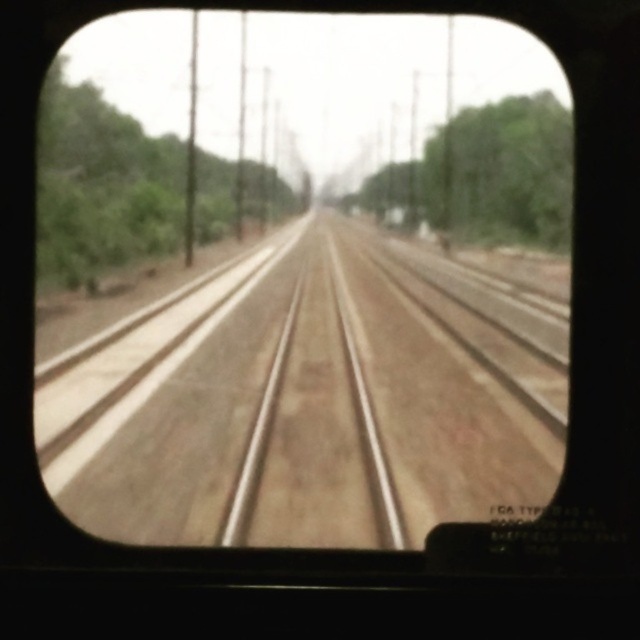
Question: In this image, where is brown dirt track at center located relative to green leafy tree at center?

Choices:
 (A) above
 (B) below

Answer: (B)

Question: Which object is farther from the camera taking this photo?

Choices:
 (A) brown dirt track at center
 (B) green leafy tree at left

Answer: (A)

Question: Is brown dirt track at center bigger than green leafy tree at left?

Choices:
 (A) yes
 (B) no

Answer: (A)

Question: In this image, where is green leafy tree at left located relative to green leafy tree at center?

Choices:
 (A) below
 (B) above

Answer: (A)

Question: Which point is closer to the camera?

Choices:
 (A) green leafy tree at center
 (B) green leafy tree at left

Answer: (B)

Question: Which point is farther to the camera?

Choices:
 (A) (237, 230)
 (B) (412, 337)

Answer: (A)